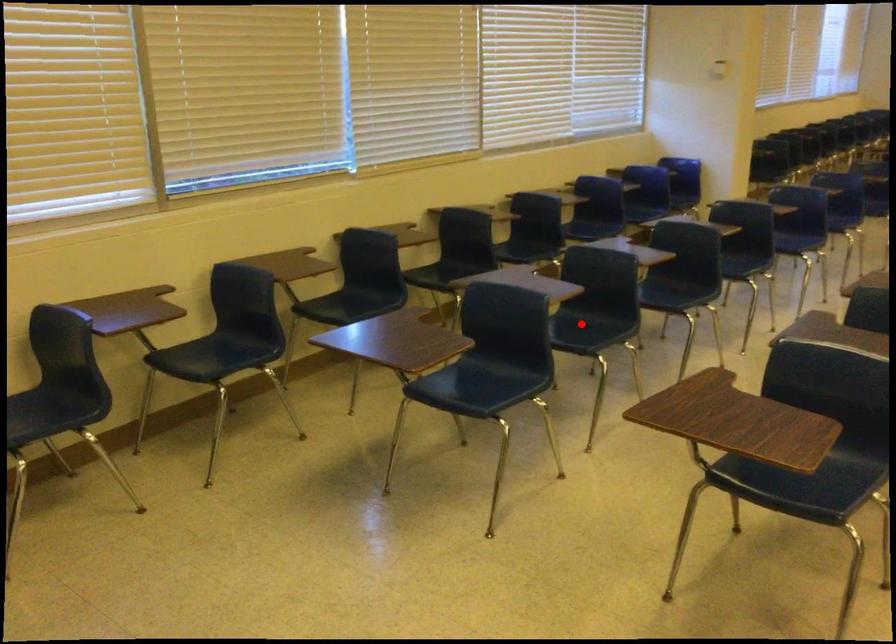
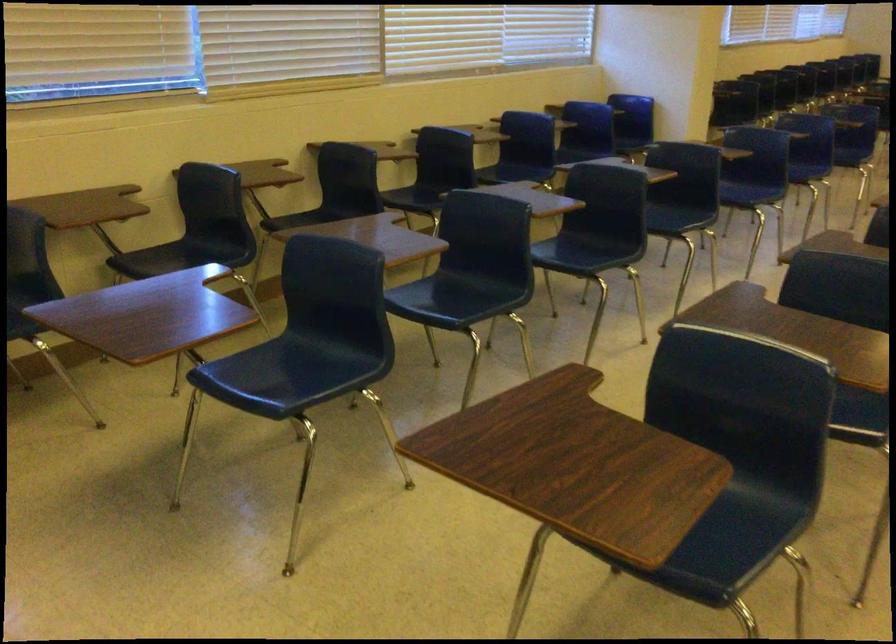
Question: A red point is marked in image1. In image2, is the corresponding 3D point closer to the camera or farther? Reply with the corresponding letter.

Choices:
 (A) The corresponding 3D point is closer.
 (B) The corresponding 3D point is farther.

Answer: (A)